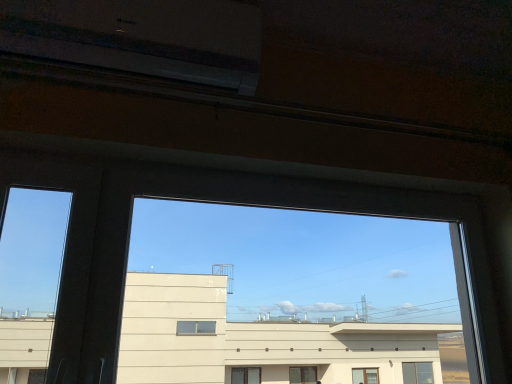
Describe the element at coordinates (285, 297) in the screenshot. I see `transparent glass window at center` at that location.

Measure the distance between transparent glass window at center and camera.

transparent glass window at center is 5.88 feet from camera.

The height and width of the screenshot is (384, 512). In order to click on transparent glass window at center in this screenshot , I will do `click(285, 297)`.

Locate an element on the screen. The height and width of the screenshot is (384, 512). white plastic air conditioning unit at upper left is located at coordinates (142, 37).

Image resolution: width=512 pixels, height=384 pixels. Describe the element at coordinates (142, 37) in the screenshot. I see `white plastic air conditioning unit at upper left` at that location.

The width and height of the screenshot is (512, 384). Identify the location of transparent glass window at center. (285, 297).

From the picture: Considering the positions of objects transparent glass window at center and white plastic air conditioning unit at upper left in the image provided, who is more to the right, transparent glass window at center or white plastic air conditioning unit at upper left?

transparent glass window at center is more to the right.

Considering the positions of objects transparent glass window at center and white plastic air conditioning unit at upper left in the image provided, who is behind, transparent glass window at center or white plastic air conditioning unit at upper left?

white plastic air conditioning unit at upper left is behind.

Considering the points (271, 341) and (237, 75), which point is in front, point (271, 341) or point (237, 75)?

Positioned in front is point (237, 75).

From the image's perspective, is transparent glass window at center above white plastic air conditioning unit at upper left?

No, from the image's perspective, transparent glass window at center is not above white plastic air conditioning unit at upper left.

Looking at this image, from a real-world perspective, is transparent glass window at center physically above white plastic air conditioning unit at upper left?

No, from a real-world perspective, transparent glass window at center is not on top of white plastic air conditioning unit at upper left.

Considering the sizes of transparent glass window at center and white plastic air conditioning unit at upper left in the image, is transparent glass window at center wider or thinner than white plastic air conditioning unit at upper left?

transparent glass window at center is thinner than white plastic air conditioning unit at upper left.

Can you confirm if transparent glass window at center is shorter than white plastic air conditioning unit at upper left?

No, transparent glass window at center is not shorter than white plastic air conditioning unit at upper left.

Between transparent glass window at center and white plastic air conditioning unit at upper left, which one has larger size?

transparent glass window at center is bigger.

Looking at this image, is transparent glass window at center situated inside white plastic air conditioning unit at upper left or outside?

transparent glass window at center lies outside white plastic air conditioning unit at upper left.

Is transparent glass window at center in contact with white plastic air conditioning unit at upper left?

No, transparent glass window at center is not making contact with white plastic air conditioning unit at upper left.

Is transparent glass window at center positioned with its back to white plastic air conditioning unit at upper left?

No, transparent glass window at center is not facing the opposite direction of white plastic air conditioning unit at upper left.

Where is `train window located in front of the white plastic air conditioning unit at upper left`? This screenshot has width=512, height=384. train window located in front of the white plastic air conditioning unit at upper left is located at coordinates click(x=285, y=297).

Is white plastic air conditioning unit at upper left at the right side of transparent glass window at center?

In fact, white plastic air conditioning unit at upper left is to the left of transparent glass window at center.

Considering the positions of objects white plastic air conditioning unit at upper left and transparent glass window at center in the image provided, who is behind, white plastic air conditioning unit at upper left or transparent glass window at center?

white plastic air conditioning unit at upper left is behind.

Does point (128, 62) come farther from viewer compared to point (143, 337)?

No, (128, 62) is closer to viewer.

From the image's perspective, does white plastic air conditioning unit at upper left appear higher than transparent glass window at center?

Indeed, from the image's perspective, white plastic air conditioning unit at upper left is shown above transparent glass window at center.

From a real-world perspective, which object stands above the other?

In real-world perspective, white plastic air conditioning unit at upper left is above.

Between white plastic air conditioning unit at upper left and transparent glass window at center, which one has smaller width?

transparent glass window at center.

Is white plastic air conditioning unit at upper left taller than transparent glass window at center?

No.

Considering the relative sizes of white plastic air conditioning unit at upper left and transparent glass window at center in the image provided, is white plastic air conditioning unit at upper left smaller than transparent glass window at center?

Yes.

Is transparent glass window at center located within white plastic air conditioning unit at upper left?

No.

Are white plastic air conditioning unit at upper left and transparent glass window at center located far from each other?

A: white plastic air conditioning unit at upper left is far away from transparent glass window at center.

Is transparent glass window at center at the back of white plastic air conditioning unit at upper left?

No.

Find the location of a particular element. This screenshot has height=384, width=512. train window located underneath the white plastic air conditioning unit at upper left (from a real-world perspective) is located at coordinates (285, 297).

Identify the location of air conditioning located on the left of transparent glass window at center. This screenshot has height=384, width=512. (142, 37).

Identify the location of air conditioning behind the transparent glass window at center. The height and width of the screenshot is (384, 512). (142, 37).